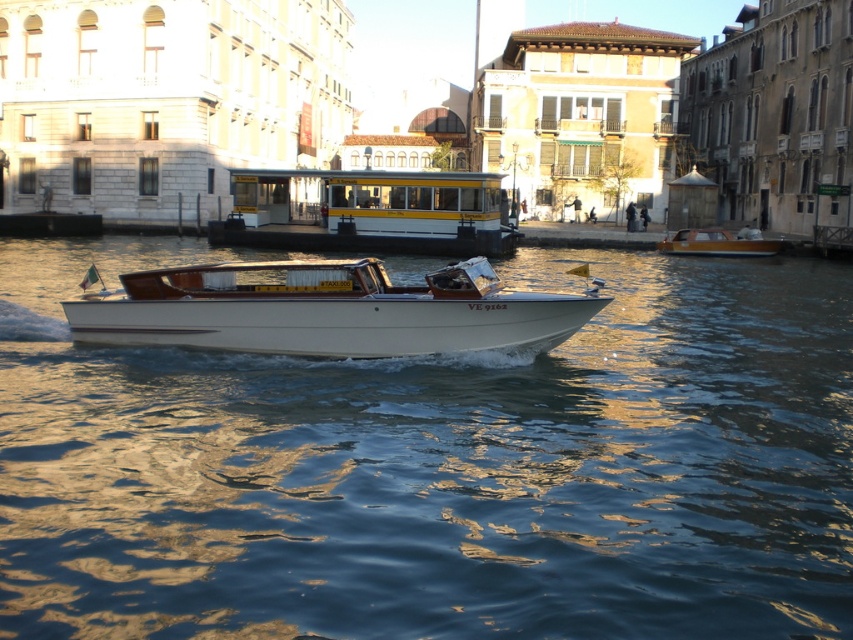
Question: Is glossy water at center bigger than wooden boat at center?

Choices:
 (A) no
 (B) yes

Answer: (B)

Question: Which object is closer to the camera taking this photo?

Choices:
 (A) glossy water at center
 (B) wooden boat at center
 (C) white polished wood boat at center
 (D) yellow matte/tinted glass ferry at center

Answer: (A)

Question: Which point appears closest to the camera in this image?

Choices:
 (A) (247, 307)
 (B) (285, 196)
 (C) (718, 236)
 (D) (409, 456)

Answer: (D)

Question: Is yellow matte/tinted glass ferry at center below wooden boat at center?

Choices:
 (A) no
 (B) yes

Answer: (A)

Question: Which point is farther to the camera?

Choices:
 (A) white polished wood boat at center
 (B) wooden boat at center
 (C) yellow matte/tinted glass ferry at center
 (D) glossy water at center

Answer: (B)

Question: Does white polished wood boat at center have a lesser width compared to wooden boat at center?

Choices:
 (A) yes
 (B) no

Answer: (B)